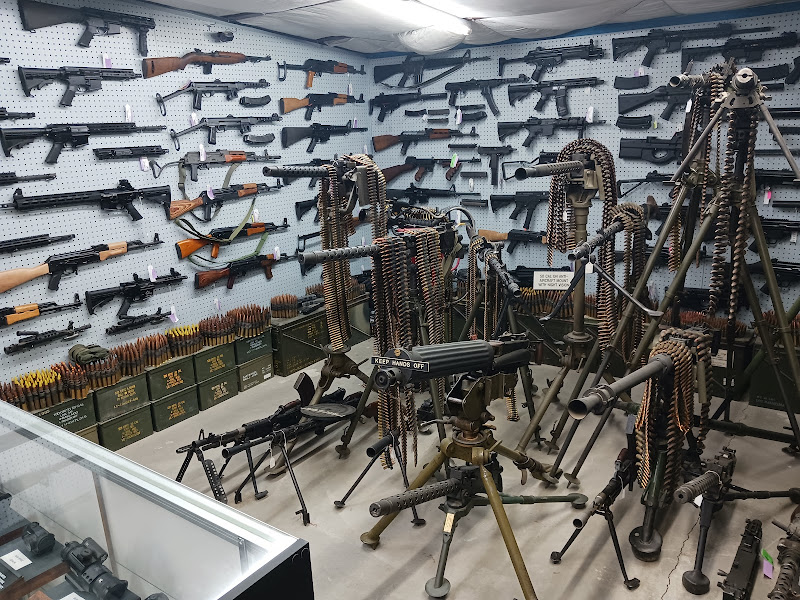
Where is `glass top`? The width and height of the screenshot is (800, 600). glass top is located at coordinates click(x=210, y=566).